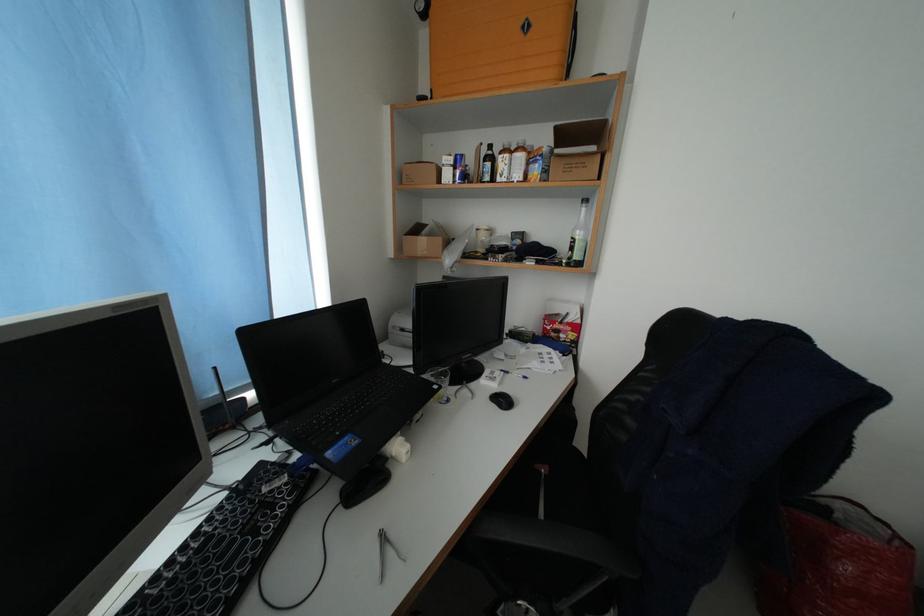
Where would you lift the blue and silver can? Please return your answer as a coordinate pair (x, y).

(458, 169)